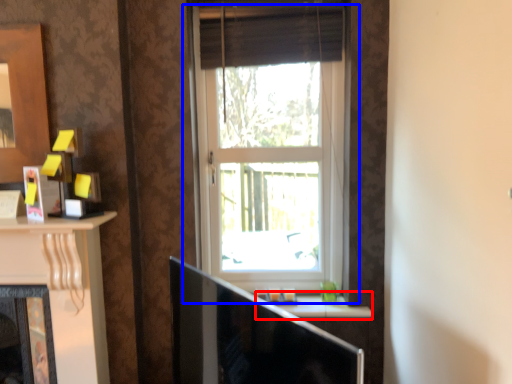
Question: Among these objects, which one is farthest to the camera, window sill (highlighted by a red box) or window (highlighted by a blue box)?

Choices:
 (A) window sill
 (B) window

Answer: (A)